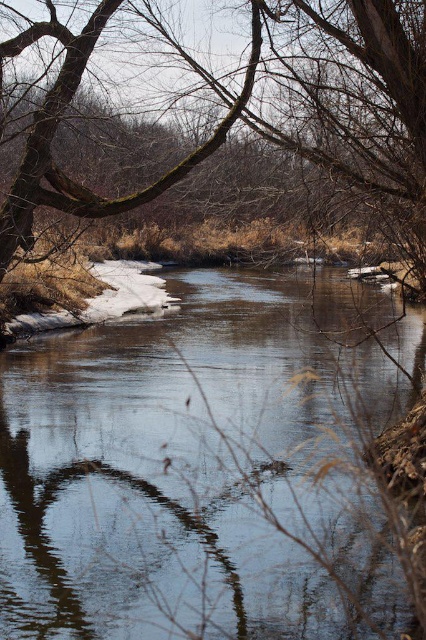
You are an artist trying to paint the winter scene. You have two main elements to focus on in your painting. The first is the clear water at center and the second is the brown mossy branch at upper left. Which of these two elements should you make larger in your painting to accurately represent their sizes as seen in the image?

The clear water at center should be made larger in the painting since it is larger in size than the brown mossy branch at upper left according to the description.

You are standing at point [175,464] in the winter scene. What do you see directly beneath your feet?

You see clear water at center directly beneath your feet at point [175,464].

You are standing in the winter scene and want to walk from the point closer to you to the point further away. Which path would you take between point (213, 368) and point (350, 1)?

You should walk towards point (350, 1) because point (213, 368) is closer to you, and point (350, 1) is further away.